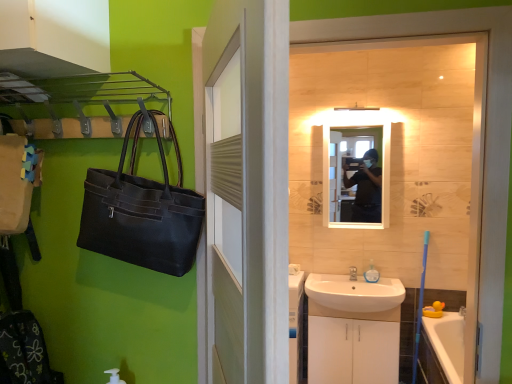
Identify the location of empty space that is ontop of matte black mirror at center (from a real-world perspective). This screenshot has height=384, width=512. (357, 117).